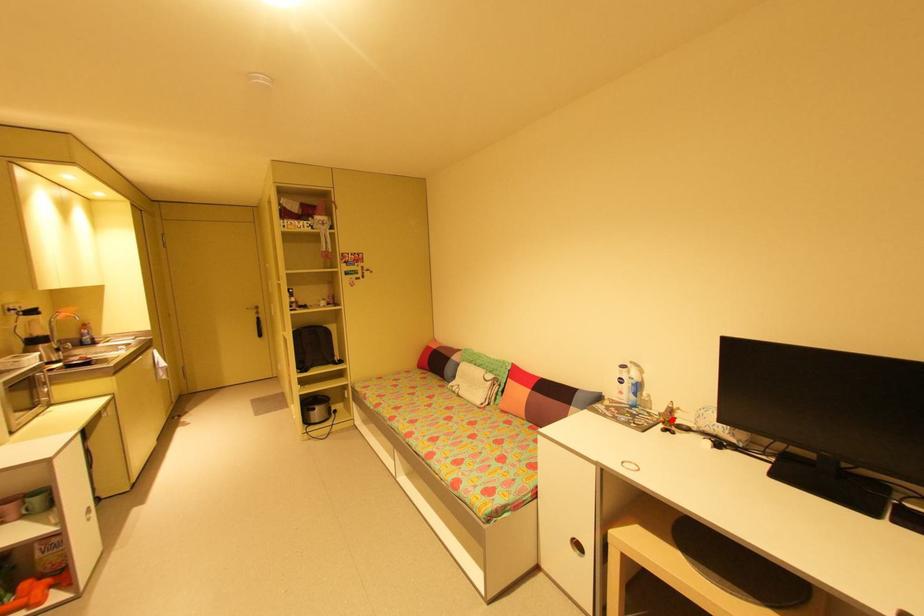
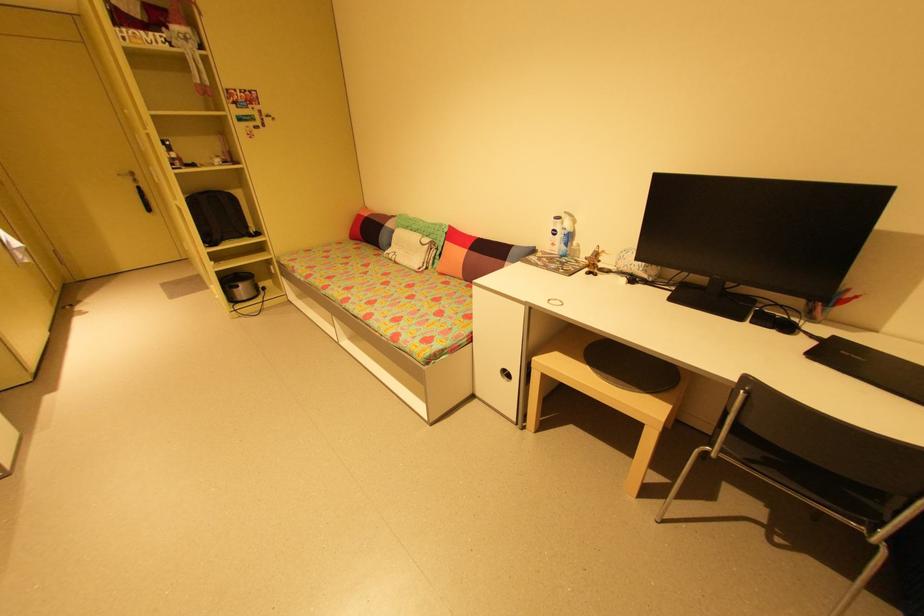
Find the pixel in the second image that matches the highlighted location in the first image.

(597, 262)